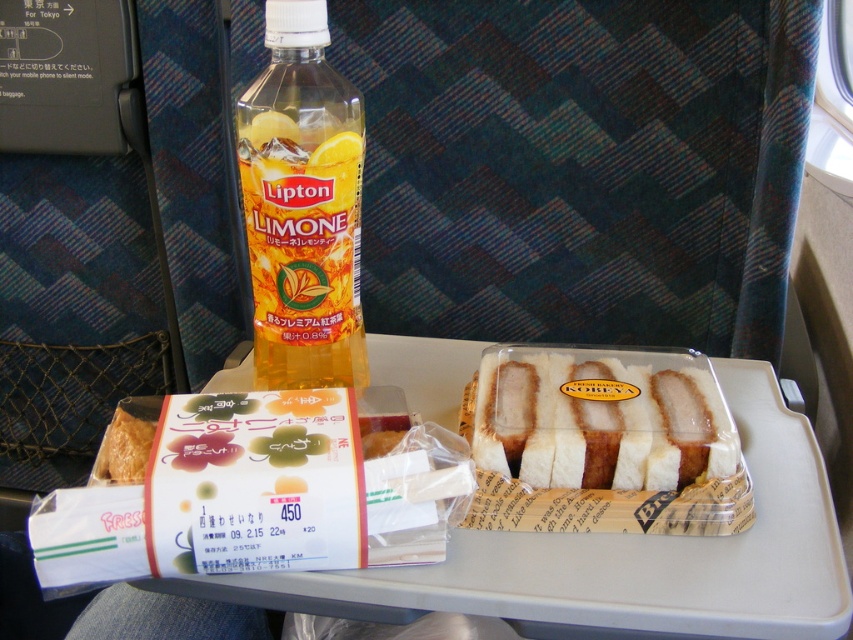
You are a flight attendant checking the meal tray. You need to ensure that the yellow translucent plastic bottle at center doesn not tip over the white bread sandwich at center. Based on their heights, is this possible?

The yellow translucent plastic bottle at center is taller than the white bread sandwich at center, so it is more likely to tip over if not placed properly. Ensure it is secured to prevent tipping.

You are a flight attendant checking the meal tray. The airline requires that all beverages must be at least 10 inches away from food items to prevent spills. Is the yellow translucent plastic bottle at center positioned correctly relative to the white bread sandwich at center?

The distance between the yellow translucent plastic bottle at center and the white bread sandwich at center is 8.36 inches, which is less than the required 10 inches. Therefore, the bottle is not positioned correctly and needs to be moved further away.